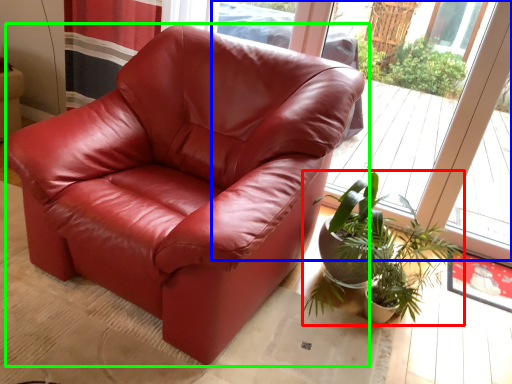
Question: Estimate the real-world distances between objects in this image. Which object is farther from houseplant (highlighted by a red box), window (highlighted by a blue box) or chair (highlighted by a green box)?

Choices:
 (A) window
 (B) chair

Answer: (A)